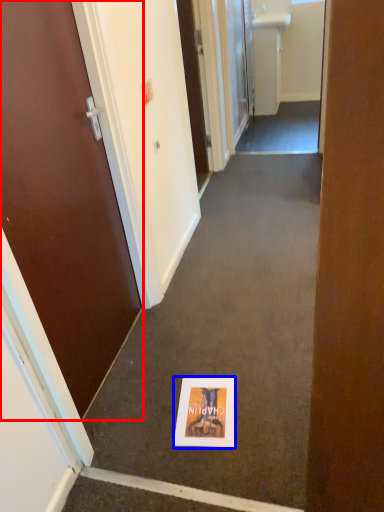
Question: Which point is further to the camera, door (highlighted by a red box) or flyer (highlighted by a blue box)?

Choices:
 (A) door
 (B) flyer

Answer: (B)